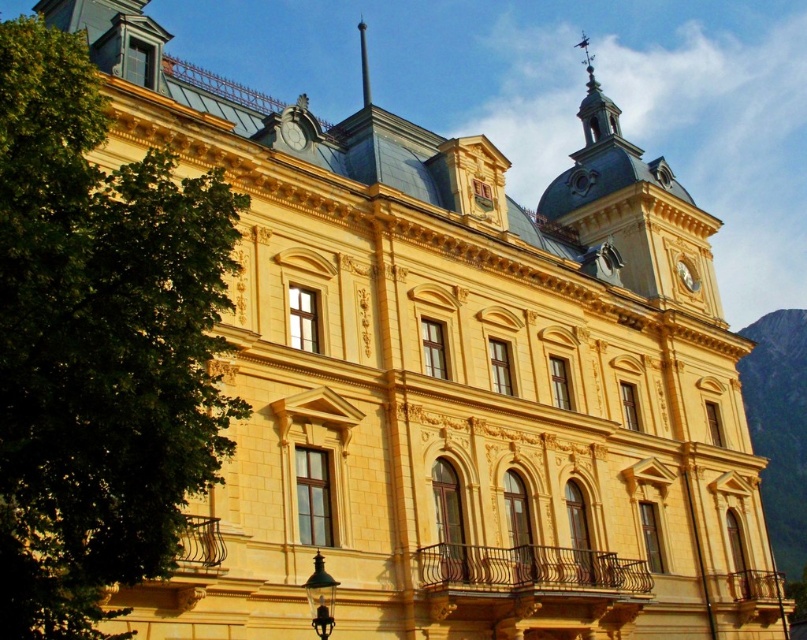
Question: From the image, what is the correct spatial relationship of matte gold clock at upper center in relation to gold metallic clock at upper center?

Choices:
 (A) left
 (B) right

Answer: (A)

Question: Which of these objects is positioned closest to the matte gold clock at upper center?

Choices:
 (A) green leafy tree at left
 (B) gold metallic clock at upper center

Answer: (A)

Question: Does green leafy tree at left have a larger size compared to matte gold clock at upper center?

Choices:
 (A) yes
 (B) no

Answer: (A)

Question: Considering the real-world distances, which object is closest to the matte gold clock at upper center?

Choices:
 (A) gold metallic clock at upper center
 (B) green leafy tree at left

Answer: (B)

Question: Does green leafy tree at left have a greater width compared to gold metallic clock at upper center?

Choices:
 (A) yes
 (B) no

Answer: (A)

Question: Among these objects, which one is nearest to the camera?

Choices:
 (A) matte gold clock at upper center
 (B) green leafy tree at left
 (C) gold metallic clock at upper center

Answer: (B)